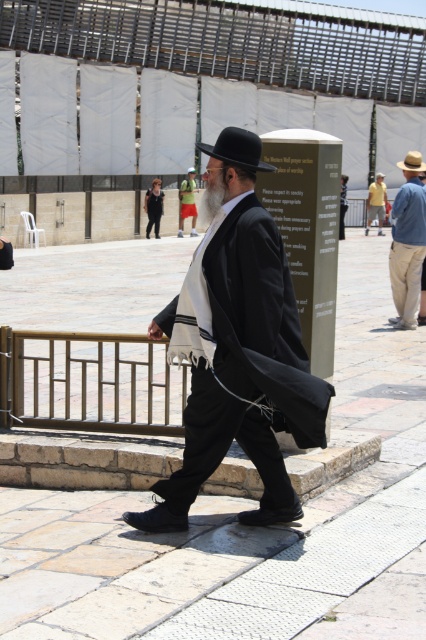
Which is below, denim pants at right or black felt fedora at center?

denim pants at right is below.

Between denim pants at right and black felt fedora at center, which one has more height?

denim pants at right is taller.

Is point (406, 243) positioned behind point (232, 157)?

Yes, point (406, 243) is behind point (232, 157).

Where is `denim pants at right`? The width and height of the screenshot is (426, 640). denim pants at right is located at coordinates (408, 241).

Does green jersey at center lie behind silky black robe at center?

Yes, green jersey at center is behind silky black robe at center.

At what (x,y) coordinates should I click in order to perform the action: click on green jersey at center. Please return your answer as a coordinate pair (x, y). Looking at the image, I should click on (187, 202).

Image resolution: width=426 pixels, height=640 pixels. Find the location of `green jersey at center`. green jersey at center is located at coordinates (187, 202).

Find the location of a particular element. smooth stone pavement at center is located at coordinates (207, 496).

Can you confirm if smooth stone pavement at center is bigger than black matte coat at center?

Yes.

The width and height of the screenshot is (426, 640). I want to click on smooth stone pavement at center, so coord(207,496).